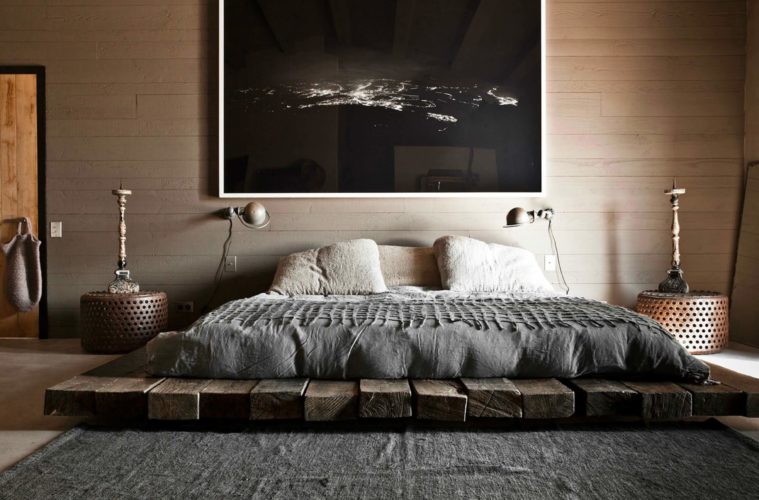
Where is `rug`? Image resolution: width=759 pixels, height=500 pixels. rug is located at coordinates (167, 438).